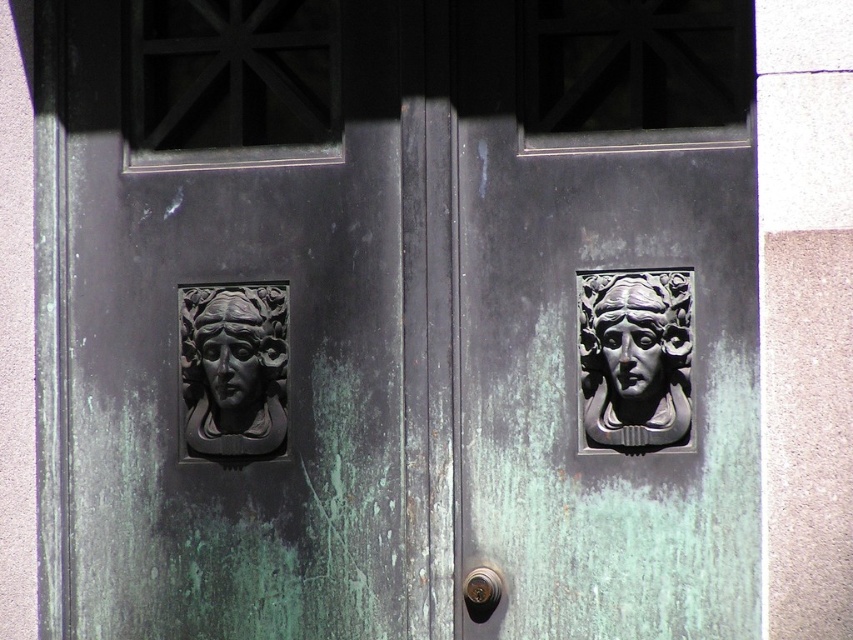
Question: Is matte bronze mask at right wider than polished brass knob at center?

Choices:
 (A) no
 (B) yes

Answer: (B)

Question: Which of the following is the farthest from the observer?

Choices:
 (A) (492, 589)
 (B) (628, 440)
 (C) (224, 339)
 (D) (635, 348)

Answer: (C)

Question: Is matte black relief at left positioned in front of polished brass knob at center?

Choices:
 (A) yes
 (B) no

Answer: (B)

Question: Among these points, which one is farthest from the camera?

Choices:
 (A) tap(660, 349)
 (B) tap(218, 291)

Answer: (B)

Question: Among these points, which one is nearest to the camera?

Choices:
 (A) coord(631,388)
 (B) coord(476,586)
 (C) coord(608,428)
 (D) coord(259,365)

Answer: (A)

Question: Does green patina face at left appear on the left side of polished brass knob at center?

Choices:
 (A) yes
 (B) no

Answer: (A)